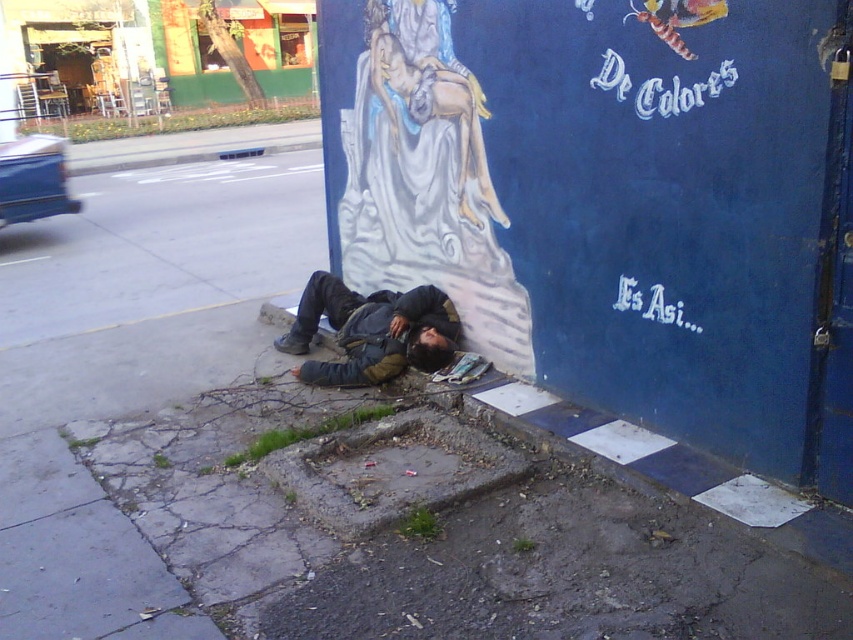
You are a pedestrian walking on the sidewalk and see the smooth concrete curb at lower center and the dark gray jacket at lower center. Which object is closer to the blue wall with white text?

Answer: The smooth concrete curb at lower center is closer to the blue wall with white text because it is positioned to the right of the dark gray jacket at lower center, and the blue wall is located to the right of the person.

You are a pedestrian walking on the sidewalk and see the smooth concrete curb at lower center and the dark gray jacket at lower center. Which object is closer to you as you approach the sidewalk?

The smooth concrete curb at lower center is closer to you because it is positioned in front of the dark gray jacket at lower center, meaning the curb is nearer to your viewpoint as you approach the sidewalk.

You are a delivery person who needs to place a package on the sidewalk. The package is 1.2 meters wide. There is a smooth concrete curb at lower center and a dark gray jacket at lower center in the image. Can you place the package between them without overlapping either object?

The smooth concrete curb at lower center is wider than the dark gray jacket at lower center. Since the package is 1.2 meters wide, you need to check the available space between them. However, without knowing the exact dimensions of the curb and jacket, it is impossible to determine if the package will fit. Please measure the space first.